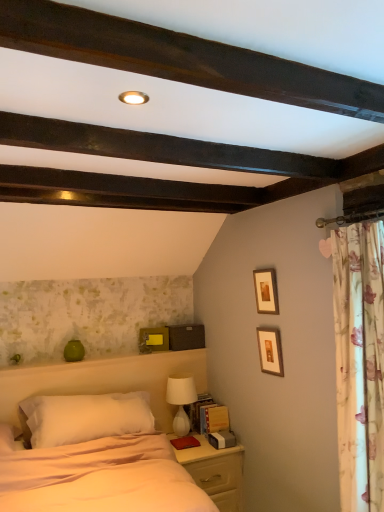
You are a GUI agent. You are given a task and a screenshot of the screen. Output one action in this format:
    pyautogui.click(x=<x>, y=<y>)
    Task: Click on the spots to the right of yellow matte picture frame at upper center, the first picture frame from the left
    
    Given the screenshot: What is the action you would take?
    171,354